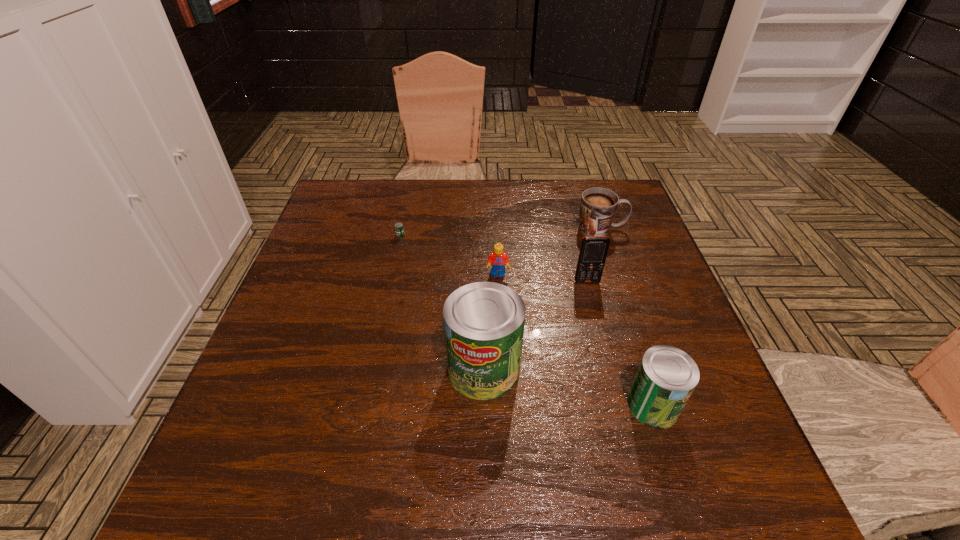
Locate an element on the screen. empty space between the fourth nearest object and the fourth farthest object is located at coordinates (542, 278).

Locate an element on the screen. The width and height of the screenshot is (960, 540). vacant region between the third farthest object and the mug is located at coordinates (549, 252).

Where is `object that is the fourth closest to the cellular telephone`? This screenshot has width=960, height=540. object that is the fourth closest to the cellular telephone is located at coordinates (667, 376).

Locate an element on the screen. Image resolution: width=960 pixels, height=540 pixels. object that is the fifth closest to the beer can is located at coordinates (667, 376).

Where is `free space that satisfies the following two spatial constraints: 1. on the side of the mug with the handle; 2. on the face of the Lego`? This screenshot has height=540, width=960. free space that satisfies the following two spatial constraints: 1. on the side of the mug with the handle; 2. on the face of the Lego is located at coordinates (616, 274).

You are a GUI agent. You are given a task and a screenshot of the screen. Output one action in this format:
    pyautogui.click(x=<x>, y=<y>)
    Task: Click on the vacant space that satisfies the following two spatial constraints: 1. on the face of the Lego; 2. on the right side of the right can
    This screenshot has height=540, width=960.
    Given the screenshot: What is the action you would take?
    pyautogui.click(x=504, y=405)

You are a GUI agent. You are given a task and a screenshot of the screen. Output one action in this format:
    pyautogui.click(x=<x>, y=<y>)
    Task: Click on the free space that satisfies the following two spatial constraints: 1. on the side of the mug with the handle; 2. on the screen of the fourth farthest object
    The height and width of the screenshot is (540, 960).
    Given the screenshot: What is the action you would take?
    pyautogui.click(x=619, y=282)

What are the coordinates of `free point that satisfies the following two spatial constraints: 1. on the screen of the right can; 2. on the right side of the cellular telephone` in the screenshot? It's located at (618, 405).

Locate an element on the screen. Image resolution: width=960 pixels, height=540 pixels. free location that satisfies the following two spatial constraints: 1. on the side of the mug with the handle; 2. on the face of the third farthest object is located at coordinates (616, 274).